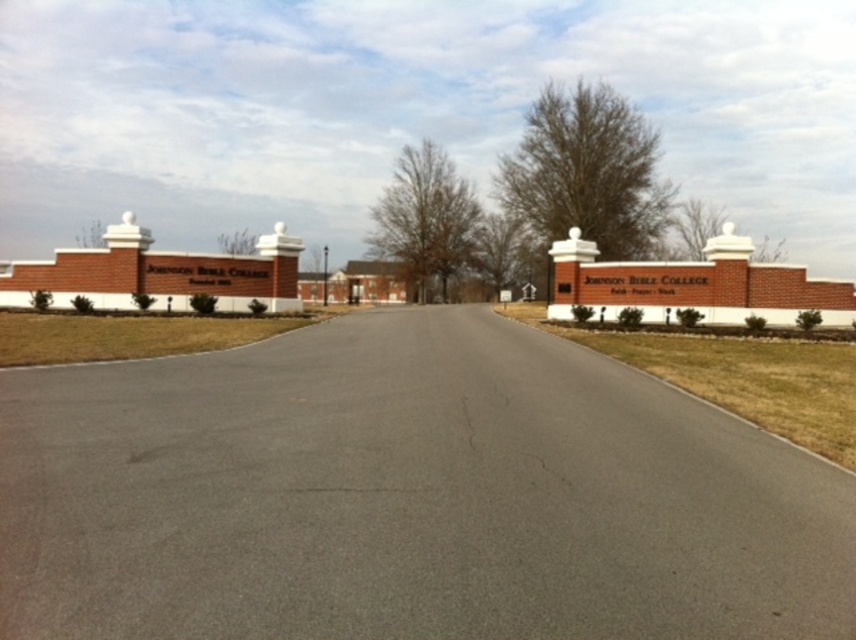
Who is more distant from viewer, (x=18, y=449) or (x=718, y=282)?

Positioned behind is point (x=718, y=282).

From the picture: Who is positioned more to the left, asphalt at center or brick sign at center?

Positioned to the left is asphalt at center.

Which is behind, point (337, 346) or point (601, 305)?

The point (601, 305) is more distant.

The width and height of the screenshot is (856, 640). I want to click on asphalt at center, so click(x=407, y=497).

Does asphalt at center appear on the left side of brick sign at upper left?

No, asphalt at center is not to the left of brick sign at upper left.

Identify the location of asphalt at center. The image size is (856, 640). (407, 497).

Between point (355, 392) and point (107, 266), which one is positioned in front?

Positioned in front is point (355, 392).

Find the location of a particular element. asphalt at center is located at coordinates (407, 497).

Who is lower down, brick sign at center or brick sign at upper left?

brick sign at center is lower down.

Is point (568, 294) less distant than point (239, 264)?

Yes.

Which is in front, point (740, 307) or point (131, 292)?

Point (740, 307) is more forward.

Where is `brick sign at center`? The image size is (856, 640). brick sign at center is located at coordinates (694, 284).